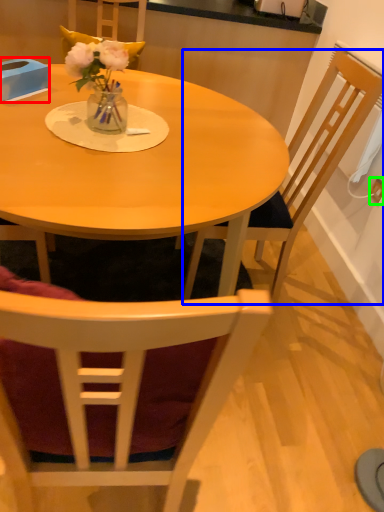
Question: Which is nearer to the box (highlighted by a red box)? chair (highlighted by a blue box) or power outlet (highlighted by a green box).

Choices:
 (A) chair
 (B) power outlet

Answer: (A)